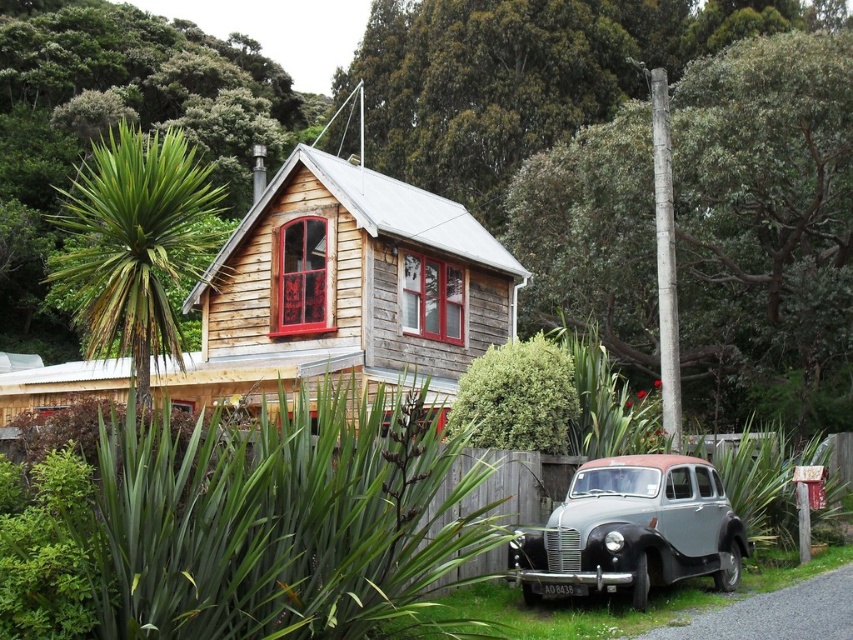
Question: Does green leafy plant at center lie in front of gray metallic car at lower right?

Choices:
 (A) yes
 (B) no

Answer: (A)

Question: Among these points, which one is nearest to the camera?

Choices:
 (A) (223, 584)
 (B) (642, 584)

Answer: (A)

Question: Is green leafy plant at center thinner than gray metallic car at lower right?

Choices:
 (A) no
 (B) yes

Answer: (A)

Question: Where is green leafy plant at center located in relation to gray metallic car at lower right in the image?

Choices:
 (A) left
 (B) right

Answer: (A)